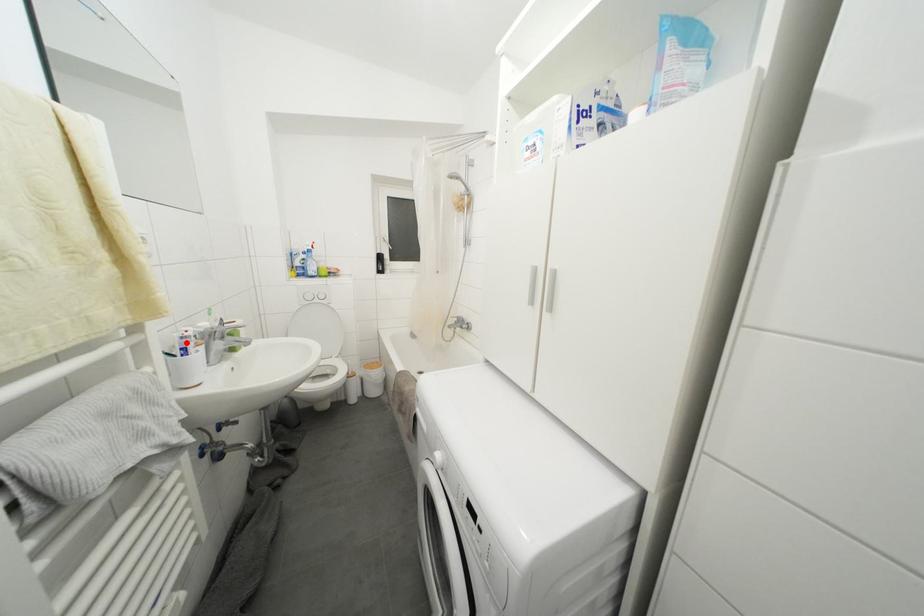
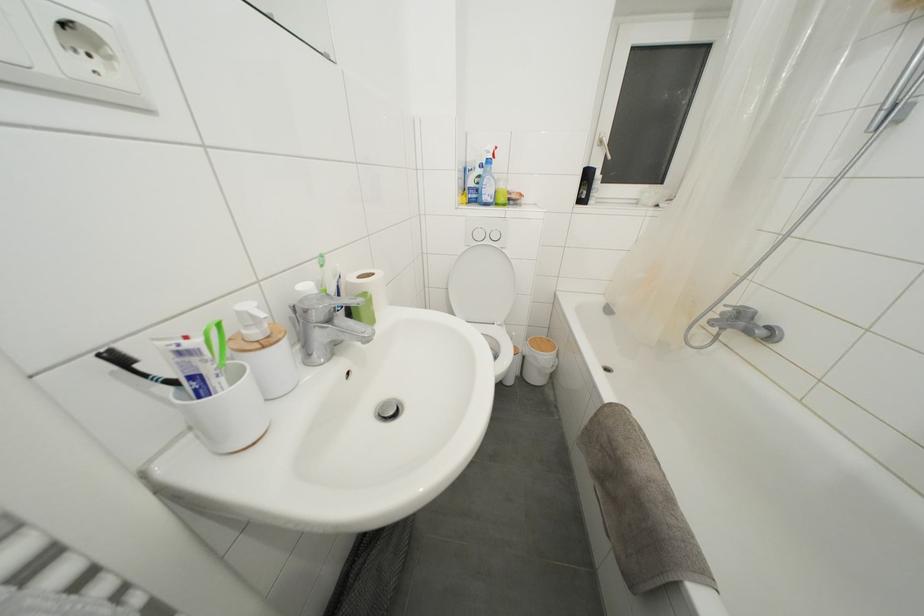
The point at the highlighted location is marked in the first image. Where is the corresponding point in the second image?

(185, 358)